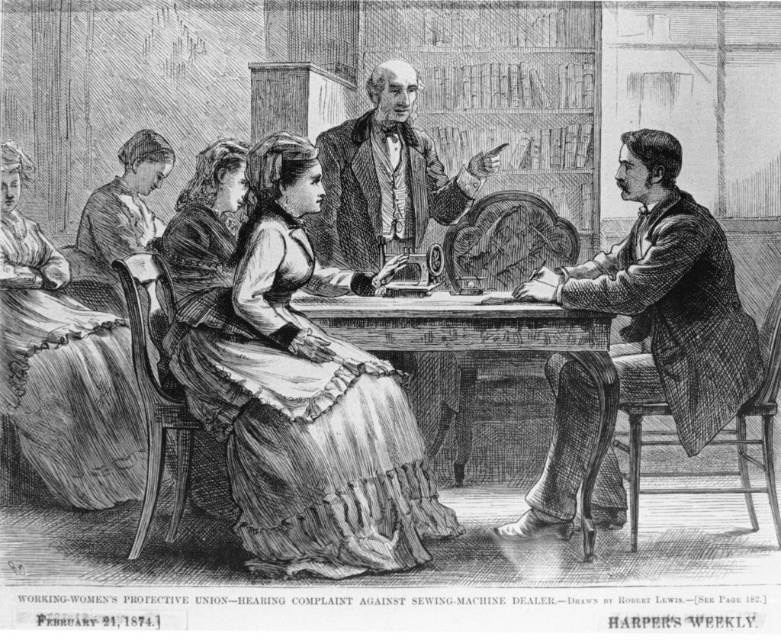
Who is taller, matte brown dress at center or smooth brown suit at right?

matte brown dress at center

Can you confirm if matte brown dress at center is positioned above smooth brown suit at right?

Correct, matte brown dress at center is located above smooth brown suit at right.

Does point (245, 541) lie behind point (617, 496)?

No.

What are the coordinates of `matte brown dress at center` in the screenshot? It's located at (294, 387).

Who is higher up, wooden table at center or smooth brown coat at center?

smooth brown coat at center

Which is below, wooden table at center or smooth brown coat at center?

wooden table at center is lower down.

Does point (494, 342) come farther from viewer compared to point (122, 218)?

That is False.

Where is `wooden table at center`? The width and height of the screenshot is (781, 640). wooden table at center is located at coordinates (458, 324).

Does smooth brown suit at right appear under wooden table at center?

Indeed, smooth brown suit at right is positioned under wooden table at center.

Is smooth brown suit at right wider than wooden table at center?

No.

Image resolution: width=781 pixels, height=640 pixels. I want to click on smooth brown suit at right, so (x=667, y=294).

You are a GUI agent. You are given a task and a screenshot of the screen. Output one action in this format:
    pyautogui.click(x=<x>, y=<y>)
    Task: Click on the smooth brown suit at right
    This screenshot has height=640, width=781.
    Given the screenshot: What is the action you would take?
    pyautogui.click(x=667, y=294)